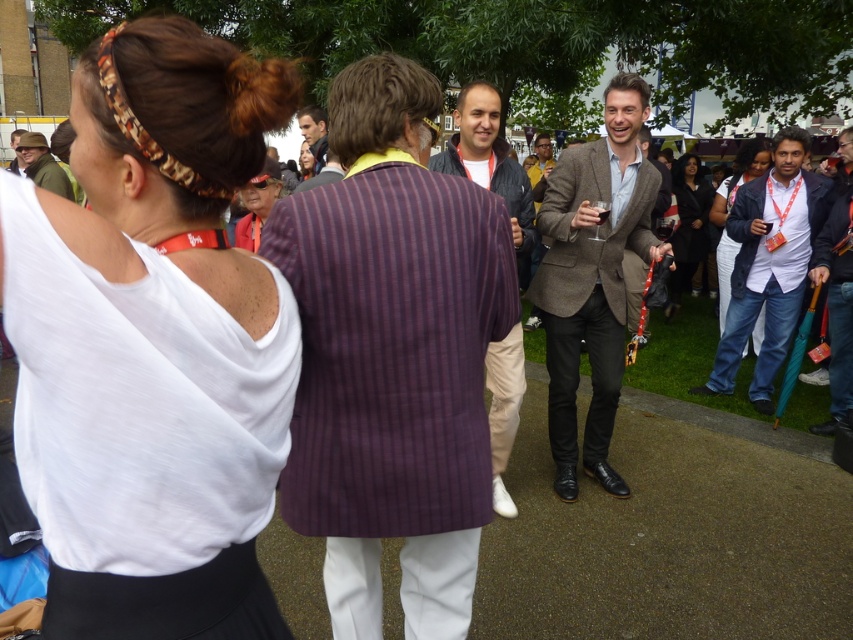
Question: Which point is farther from the camera taking this photo?

Choices:
 (A) (749, 221)
 (B) (157, 550)
 (C) (828, 314)

Answer: (A)

Question: Does white matte fabric at upper left have a greater width compared to blue denim jeans at lower right?

Choices:
 (A) no
 (B) yes

Answer: (A)

Question: Which of these objects is positioned closest to the khaki fabric hat at upper left?

Choices:
 (A) dark blue jacket at center
 (B) dark brown striped suit at center
 (C) white shirt and jeans at center
 (D) matte yellow shirt at center

Answer: (B)

Question: Is white matte fabric at upper left above matte yellow shirt at center?

Choices:
 (A) no
 (B) yes

Answer: (A)

Question: Which object is closer to the camera taking this photo?

Choices:
 (A) white shirt and jeans at center
 (B) textured brown blazer at center
 (C) matte black hair at center
 (D) matte red shirt at center

Answer: (D)

Question: Is white matte fabric at upper left bigger than matte black sunglasses at upper left?

Choices:
 (A) yes
 (B) no

Answer: (B)